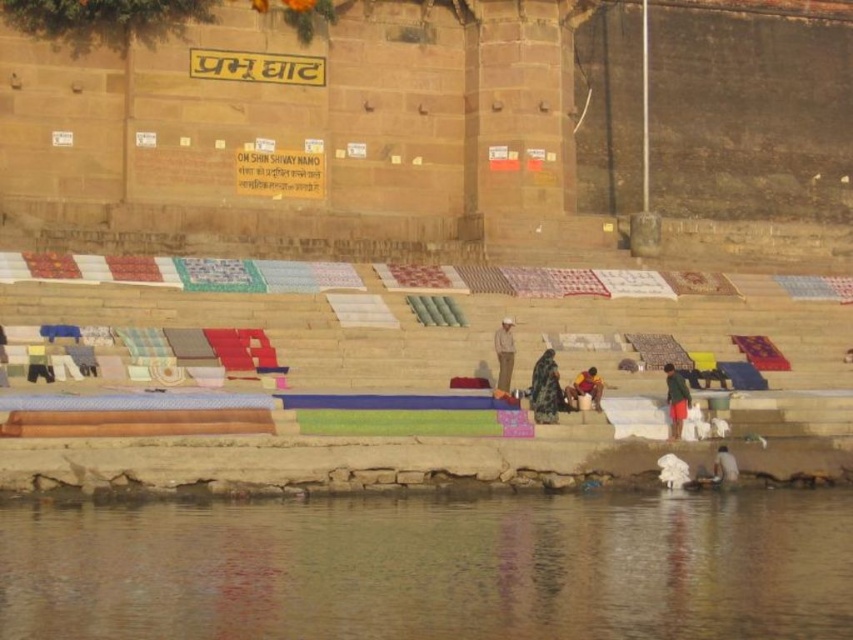
Is green fabric at center thinner than dark blue fabric at center?

Yes.

Measure the distance between point (680,388) and camera.

The distance of point (680,388) from camera is 162.85 feet.

Find the location of a particular element. This screenshot has width=853, height=640. green fabric at center is located at coordinates (676, 400).

Does brown water at lower center appear on the right side of dark blue fabric at center?

In fact, brown water at lower center is to the left of dark blue fabric at center.

Can you confirm if brown water at lower center is wider than dark blue fabric at center?

Yes, brown water at lower center is wider than dark blue fabric at center.

The width and height of the screenshot is (853, 640). What do you see at coordinates (432, 566) in the screenshot?
I see `brown water at lower center` at bounding box center [432, 566].

Locate an element on the screen. This screenshot has width=853, height=640. brown water at lower center is located at coordinates (432, 566).

Who is positioned more to the left, dark green fabric at center or dark blue fabric at center?

From the viewer's perspective, dark green fabric at center appears more on the left side.

Which of these two, dark green fabric at center or dark blue fabric at center, stands shorter?

dark blue fabric at center is shorter.

The height and width of the screenshot is (640, 853). I want to click on dark green fabric at center, so pos(544,388).